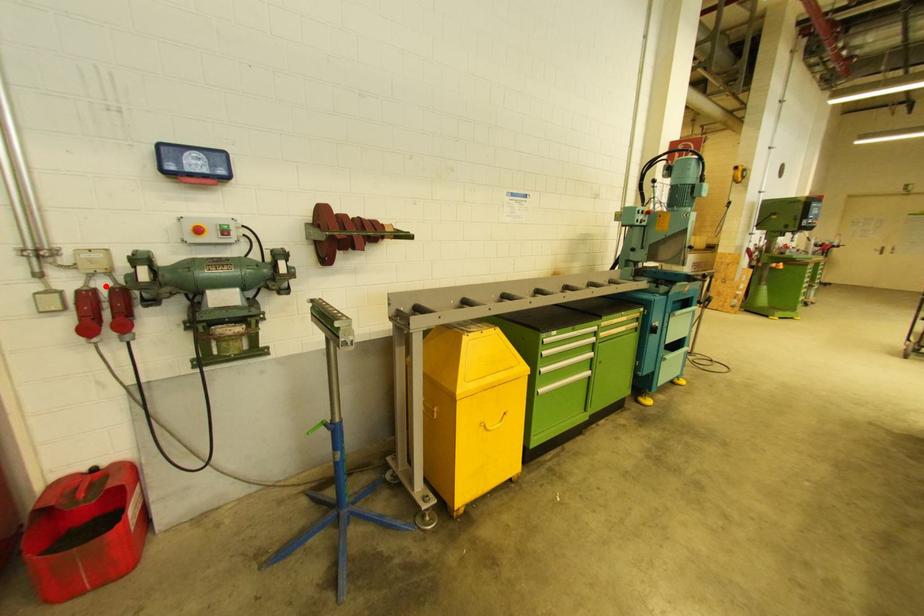
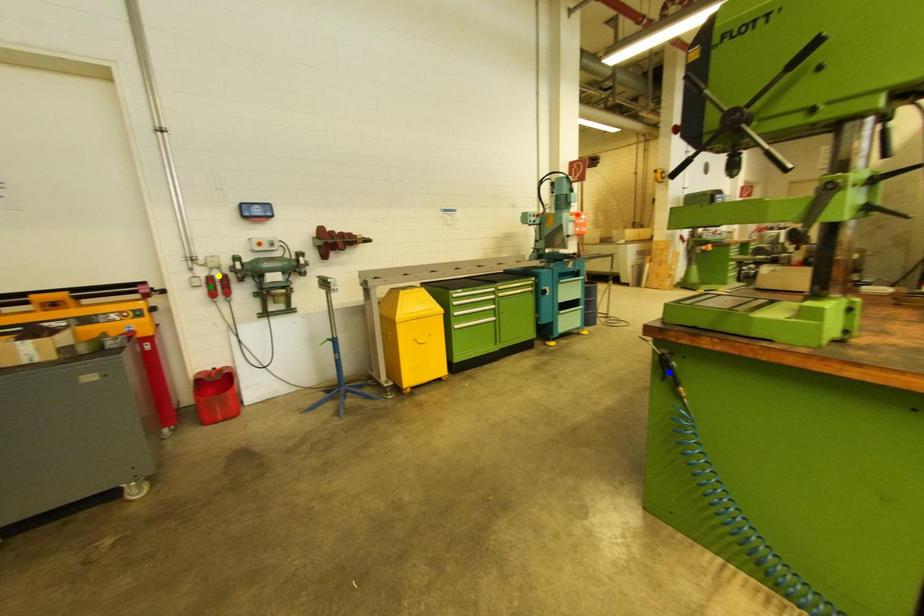
Question: I am providing you with two images of the same scene from different viewpoints. A red point is marked on the first image. You are given multiple points on the second image. Which spot in image 2 lines up with the point in image 1?

Choices:
 (A) blue point
 (B) green point
 (C) yellow point

Answer: (C)